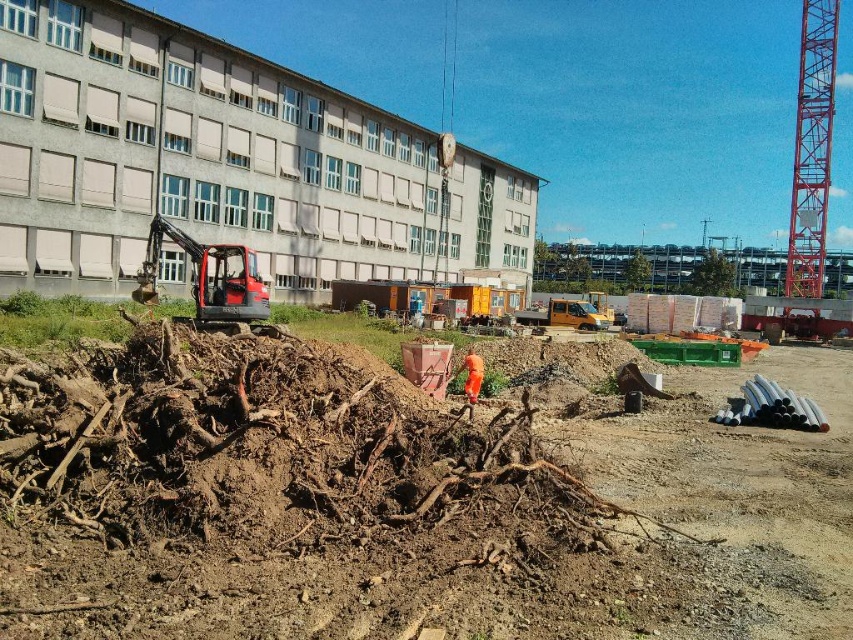
Question: Is brown earthy dirt at center below orange fabric construction worker at center?

Choices:
 (A) yes
 (B) no

Answer: (A)

Question: Which point appears farthest from the camera in this image?

Choices:
 (A) (187, 518)
 (B) (799, 81)
 (C) (479, 362)

Answer: (B)

Question: Which point is farther to the camera?

Choices:
 (A) (469, 378)
 (B) (808, 275)
 (C) (219, 285)

Answer: (B)

Question: Can you confirm if red metallic tower crane at right is positioned below orange fabric construction worker at center?

Choices:
 (A) yes
 (B) no

Answer: (B)

Question: Which of these objects is positioned farthest from the orange fabric construction worker at center?

Choices:
 (A) matte black excavator at center
 (B) red metallic tower crane at right

Answer: (B)

Question: Does red metallic tower crane at right appear on the right side of orange fabric construction worker at center?

Choices:
 (A) no
 (B) yes

Answer: (B)